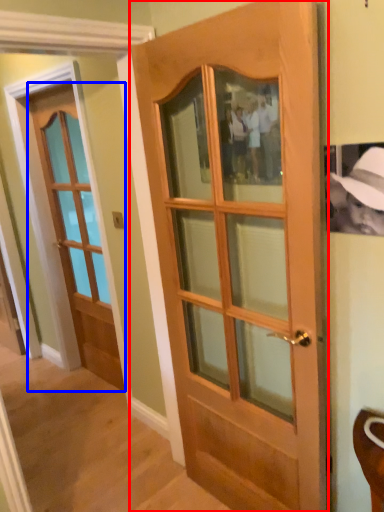
Question: Which object is closer to the camera taking this photo, door (highlighted by a red box) or door (highlighted by a blue box)?

Choices:
 (A) door
 (B) door

Answer: (A)